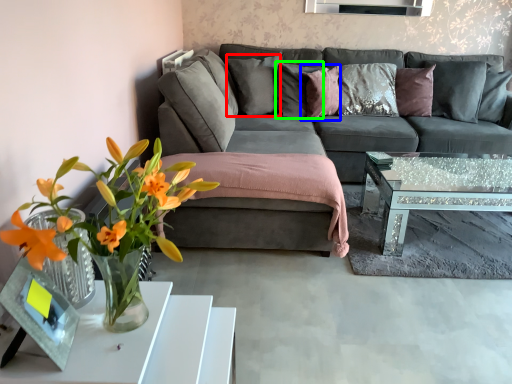
Question: Which object is the closest to the pillow (highlighted by a red box)? Choose among these: pillow (highlighted by a blue box) or pillow (highlighted by a green box).

Choices:
 (A) pillow
 (B) pillow

Answer: (B)